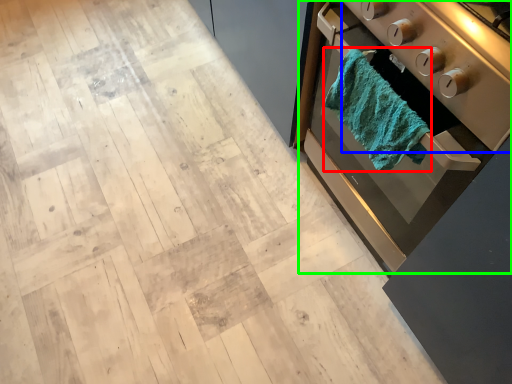
Question: Which object is positioned farthest from bath towel (highlighted by a red box)? Select from appliance (highlighted by a blue box) and home appliance (highlighted by a green box).

Choices:
 (A) appliance
 (B) home appliance

Answer: (A)